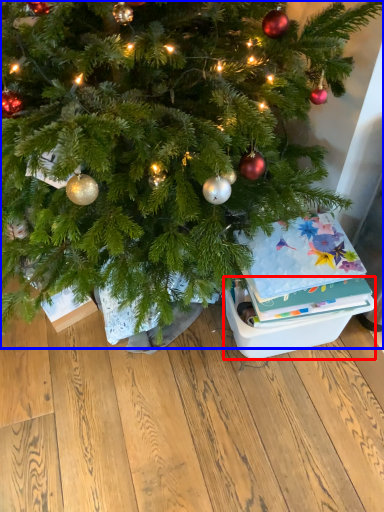
Question: Among these objects, which one is nearest to the camera, storage box (highlighted by a red box) or christmas tree (highlighted by a blue box)?

Choices:
 (A) storage box
 (B) christmas tree

Answer: (B)